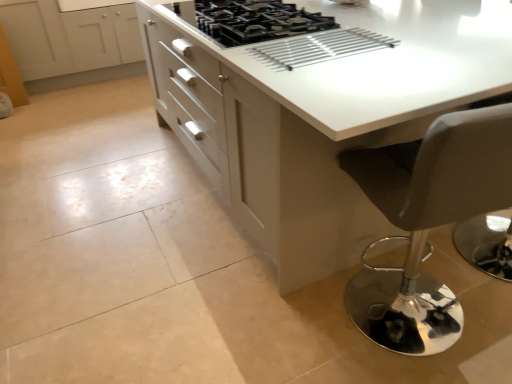
Question: Considering the relative positions of white glossy countertop at center and matte black stool at lower right in the image provided, is white glossy countertop at center to the left of matte black stool at lower right from the viewer's perspective?

Choices:
 (A) no
 (B) yes

Answer: (B)

Question: Does white glossy countertop at center have a lesser height compared to matte black stool at lower right?

Choices:
 (A) yes
 (B) no

Answer: (A)

Question: Is white glossy countertop at center aimed at matte black stool at lower right?

Choices:
 (A) no
 (B) yes

Answer: (A)

Question: From a real-world perspective, is white glossy countertop at center located higher than matte black stool at lower right?

Choices:
 (A) no
 (B) yes

Answer: (A)

Question: From the image's perspective, is white glossy countertop at center located above matte black stool at lower right?

Choices:
 (A) no
 (B) yes

Answer: (B)

Question: Is white glossy countertop at center thinner than matte black stool at lower right?

Choices:
 (A) yes
 (B) no

Answer: (B)

Question: Can we say matte black stool at lower right lies outside white glossy countertop at center?

Choices:
 (A) no
 (B) yes

Answer: (A)

Question: Can you confirm if matte black stool at lower right is positioned to the right of white glossy countertop at center?

Choices:
 (A) no
 (B) yes

Answer: (B)

Question: Does matte black stool at lower right touch white glossy countertop at center?

Choices:
 (A) no
 (B) yes

Answer: (A)

Question: Does matte black stool at lower right have a lesser height compared to white glossy countertop at center?

Choices:
 (A) yes
 (B) no

Answer: (B)

Question: From a real-world perspective, is matte black stool at lower right beneath white glossy countertop at center?

Choices:
 (A) no
 (B) yes

Answer: (A)

Question: Considering the relative sizes of matte black stool at lower right and white glossy countertop at center in the image provided, is matte black stool at lower right bigger than white glossy countertop at center?

Choices:
 (A) yes
 (B) no

Answer: (B)

Question: Are black matte gas stove at center and matte black stool at lower right located far from each other?

Choices:
 (A) no
 (B) yes

Answer: (B)